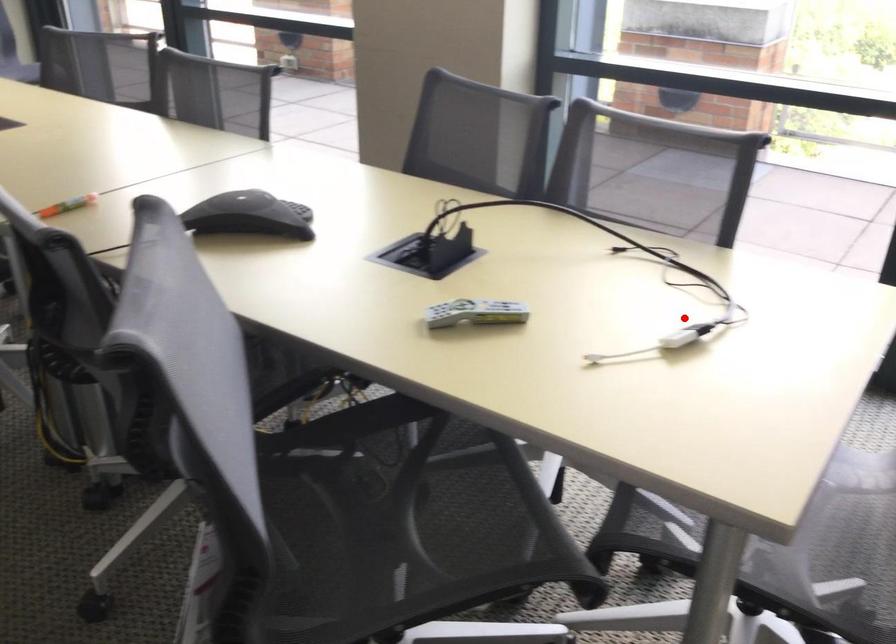
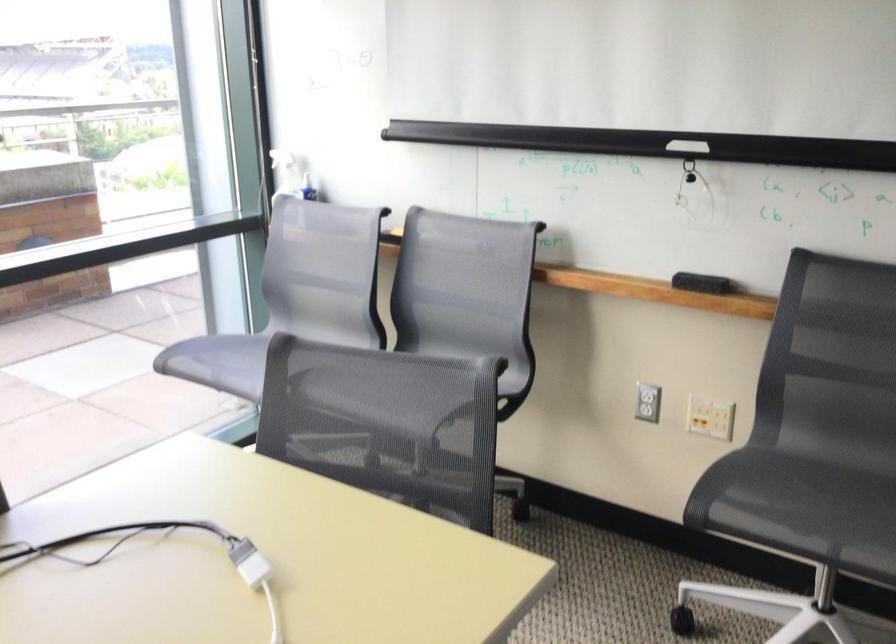
Find the pixel in the second image that matches the highlighted location in the first image.

(161, 554)